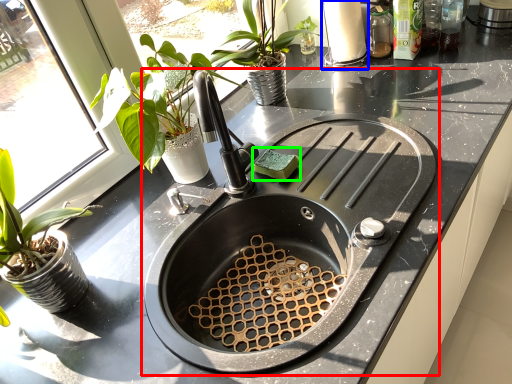
Question: Which object is positioned farthest from sink (highlighted by a red box)? Select from appliance (highlighted by a blue box) and food (highlighted by a green box).

Choices:
 (A) appliance
 (B) food

Answer: (A)